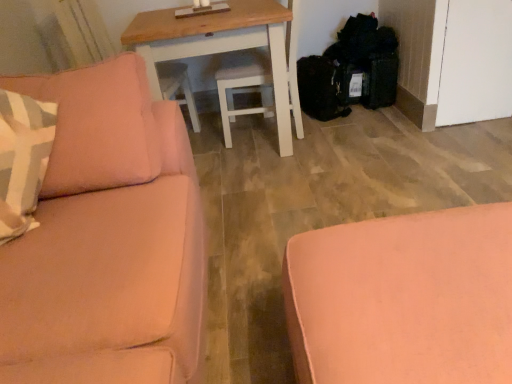
Question: From the image's perspective, is wooden table at center located above or below pink fabric ottoman at lower right, acting as the second studio couch starting from the left?

Choices:
 (A) above
 (B) below

Answer: (A)

Question: Which is correct: wooden table at center is inside pink fabric ottoman at lower right, acting as the second studio couch starting from the left, or outside of it?

Choices:
 (A) outside
 (B) inside

Answer: (A)

Question: Which of these objects is positioned farthest from the pink fabric ottoman at lower right, the first studio couch from the right?

Choices:
 (A) satin pink couch at left, which appears as the second studio couch when viewed from the right
 (B) wooden table at center

Answer: (B)

Question: Estimate the real-world distances between objects in this image. Which object is farther from the wooden table at center?

Choices:
 (A) pink fabric ottoman at lower right, the first studio couch from the right
 (B) satin pink couch at left, which appears as the second studio couch when viewed from the right

Answer: (A)